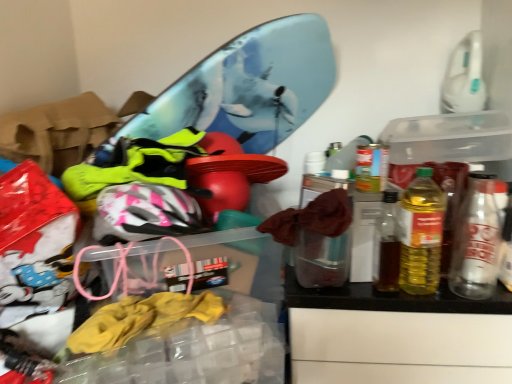
Question: Would you say yellow translucent bottle at right, which is the second bottle in right-to-left order, is to the left or to the right of metallic silver can at right, the 1th bottle positioned from the right, in the picture?

Choices:
 (A) right
 (B) left

Answer: (B)

Question: Considering the positions of yellow translucent bottle at right, which is the second bottle in right-to-left order, and metallic silver can at right, the 1th bottle positioned from the right, in the image, is yellow translucent bottle at right, which is the second bottle in right-to-left order, taller or shorter than metallic silver can at right, the 1th bottle positioned from the right,?

Choices:
 (A) tall
 (B) short

Answer: (A)

Question: In terms of width, does yellow translucent bottle at right, marked as the 1th bottle in a left-to-right arrangement, look wider or thinner when compared to metallic silver can at right, the 1th bottle positioned from the right?

Choices:
 (A) wide
 (B) thin

Answer: (A)

Question: Is metallic silver can at right, the 1th bottle positioned from the right, in front of or behind yellow translucent bottle at right, which is the second bottle in right-to-left order, in the image?

Choices:
 (A) front
 (B) behind

Answer: (B)

Question: Is metallic silver can at right, which ranks as the second bottle in left-to-right order, bigger or smaller than yellow translucent bottle at right, which is the second bottle in right-to-left order?

Choices:
 (A) small
 (B) big

Answer: (A)

Question: Considering the positions of metallic silver can at right, the 1th bottle positioned from the right, and yellow translucent bottle at right, marked as the 1th bottle in a left-to-right arrangement, in the image, is metallic silver can at right, the 1th bottle positioned from the right, taller or shorter than yellow translucent bottle at right, marked as the 1th bottle in a left-to-right arrangement,?

Choices:
 (A) tall
 (B) short

Answer: (B)

Question: From a real-world perspective, is metallic silver can at right, which ranks as the second bottle in left-to-right order, positioned above or below yellow translucent bottle at right, marked as the 1th bottle in a left-to-right arrangement?

Choices:
 (A) above
 (B) below

Answer: (B)